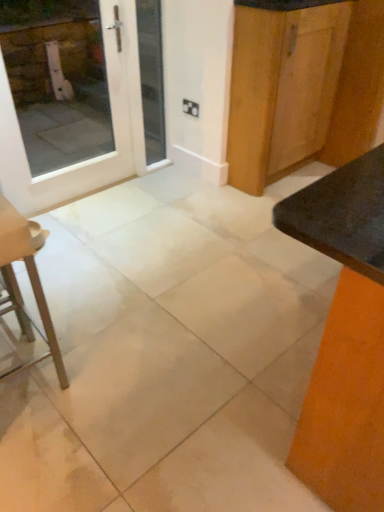
Question: Should I look upward or downward to see matte black table at right?

Choices:
 (A) down
 (B) up

Answer: (A)

Question: Can you confirm if matte black table at right is positioned to the left of white glass door at upper left?

Choices:
 (A) yes
 (B) no

Answer: (B)

Question: Is matte black table at right shorter than white glass door at upper left?

Choices:
 (A) no
 (B) yes

Answer: (B)

Question: Can you confirm if matte black table at right is bigger than white glass door at upper left?

Choices:
 (A) no
 (B) yes

Answer: (B)

Question: Does matte black table at right have a greater height compared to white glass door at upper left?

Choices:
 (A) no
 (B) yes

Answer: (A)

Question: Can you see matte black table at right touching white glass door at upper left?

Choices:
 (A) yes
 (B) no

Answer: (B)

Question: Is there a large distance between matte black table at right and white glass door at upper left?

Choices:
 (A) yes
 (B) no

Answer: (A)

Question: Can you confirm if white glass door at upper left is taller than wooden cabinet at upper right?

Choices:
 (A) yes
 (B) no

Answer: (B)

Question: Does white glass door at upper left have a smaller size compared to wooden cabinet at upper right?

Choices:
 (A) no
 (B) yes

Answer: (B)

Question: Does white glass door at upper left appear on the right side of wooden cabinet at upper right?

Choices:
 (A) yes
 (B) no

Answer: (B)

Question: Considering the relative sizes of white glass door at upper left and wooden cabinet at upper right in the image provided, is white glass door at upper left thinner than wooden cabinet at upper right?

Choices:
 (A) yes
 (B) no

Answer: (A)

Question: From a real-world perspective, does white glass door at upper left sit lower than wooden cabinet at upper right?

Choices:
 (A) no
 (B) yes

Answer: (B)

Question: Is white glass door at upper left next to wooden cabinet at upper right and touching it?

Choices:
 (A) no
 (B) yes

Answer: (A)

Question: Is white glossy door at upper left not near matte black table at right?

Choices:
 (A) yes
 (B) no

Answer: (A)